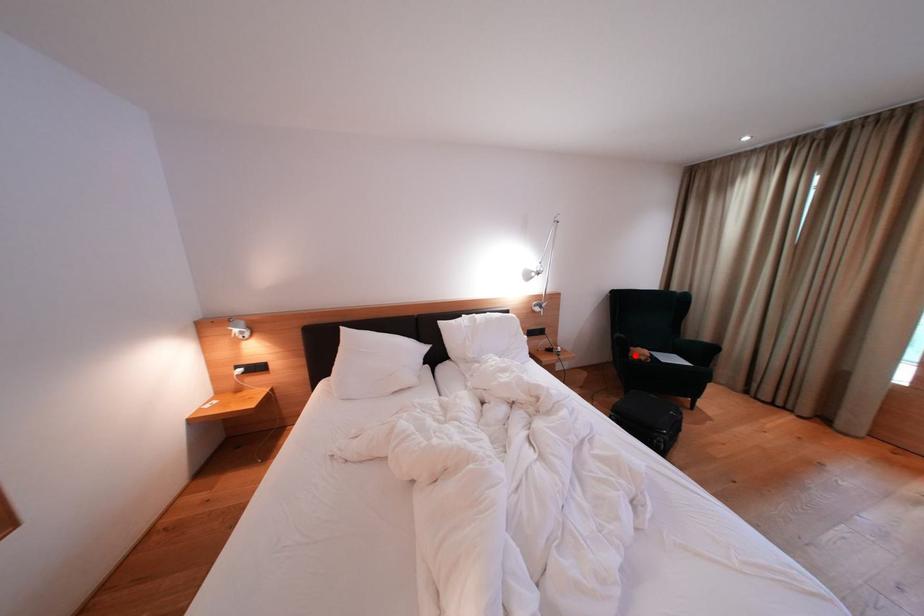
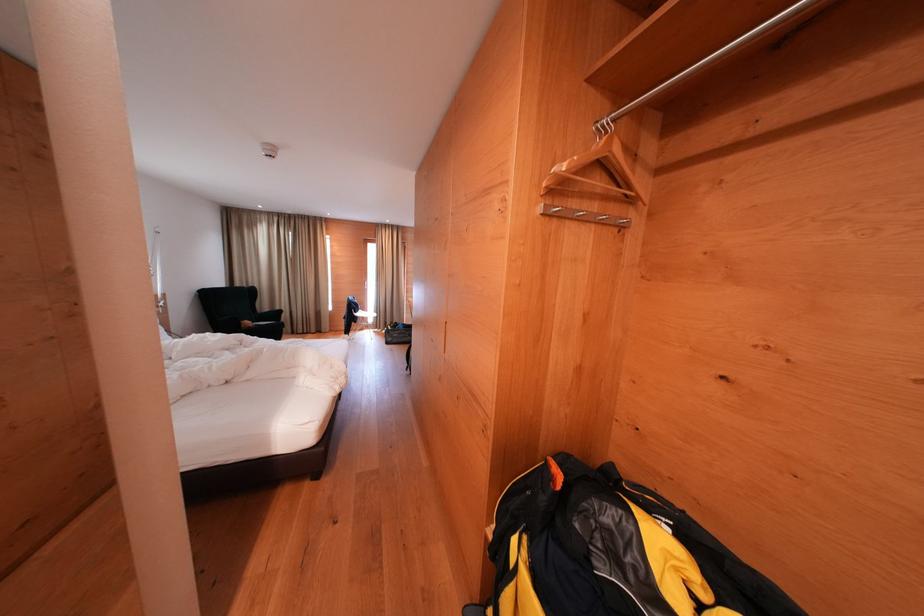
Question: I am providing you with two images of the same scene from different viewpoints. Image1 has a red point marked. In image2, the corresponding 3D location appears at what relative position? Reply with the corresponding letter.

Choices:
 (A) Closer
 (B) Farther

Answer: (B)